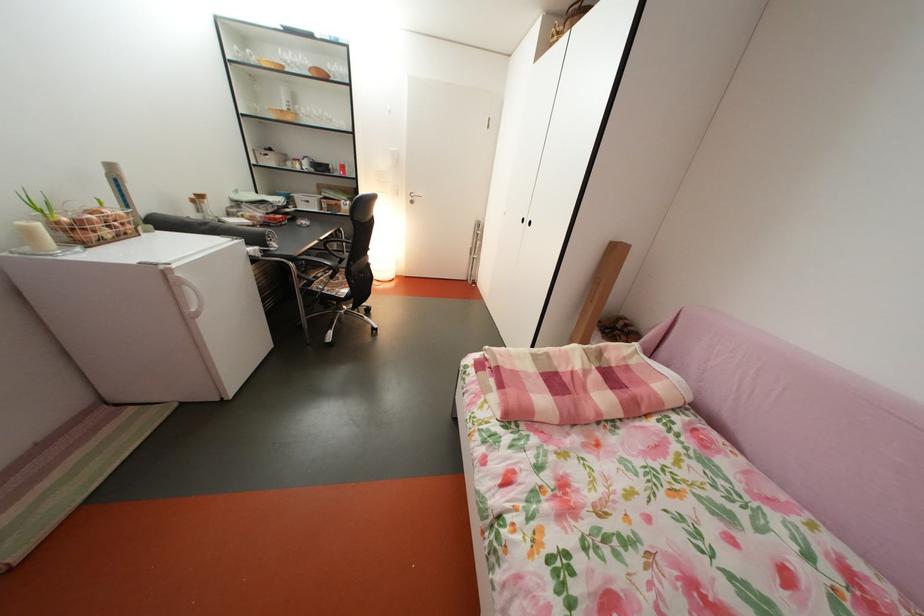
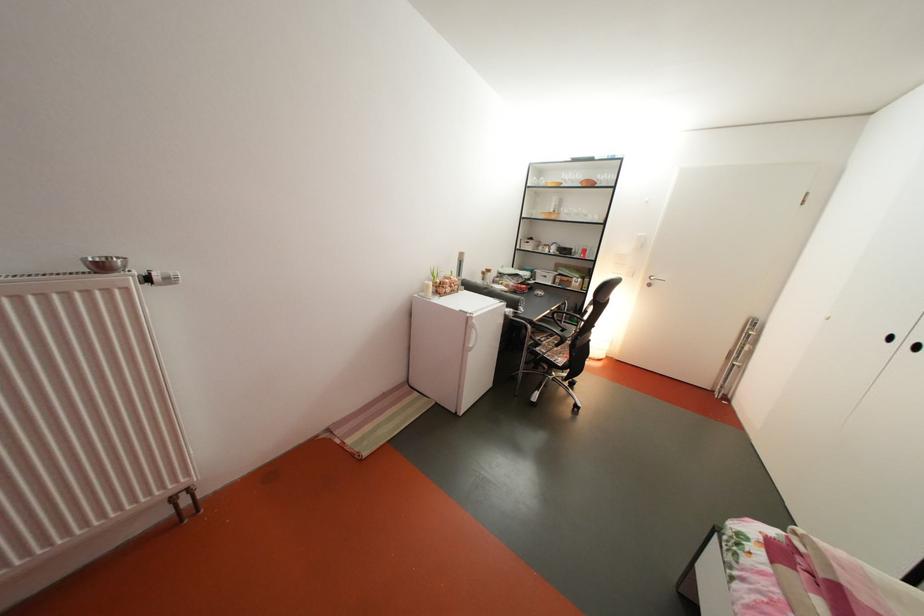
Find the pixel in the second image that matches [354,257] in the first image.

(573, 328)